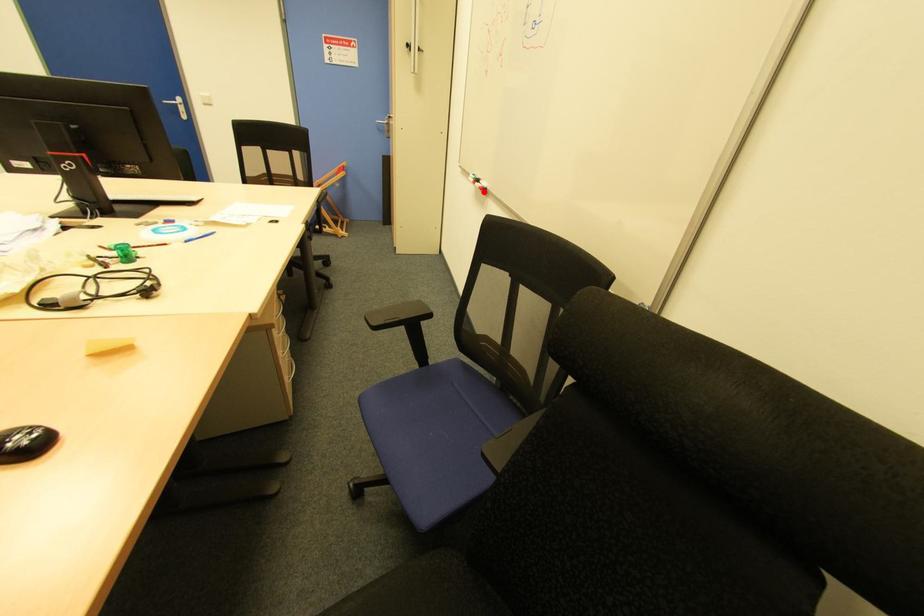
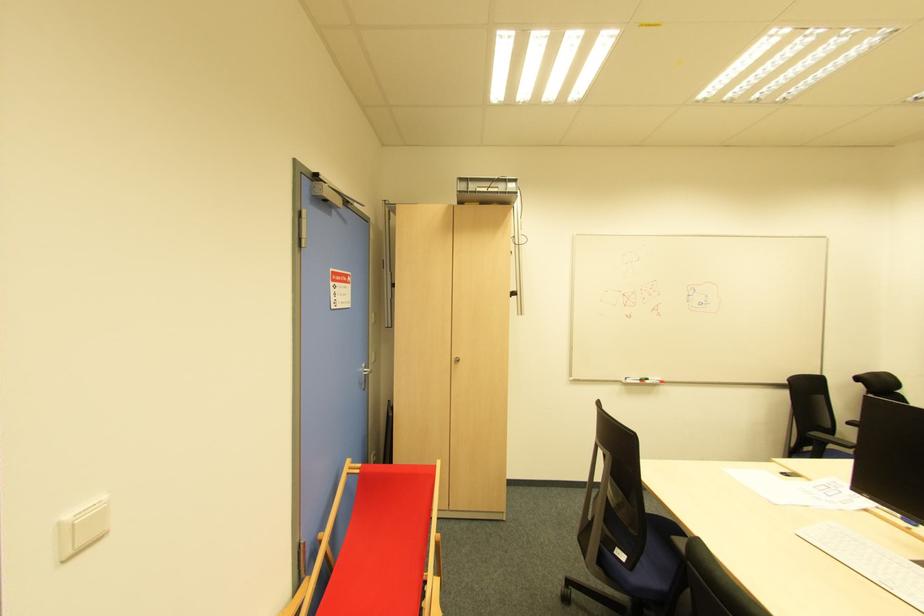
Where in the second image is the point corresponding to the highlighted location from the first image?

(662, 383)